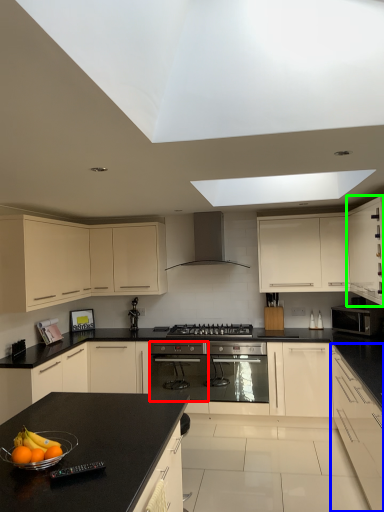
Question: Which object is positioned closest to appliance (highlighted by a red box)? Select from cabinetry (highlighted by a blue box) and cabinetry (highlighted by a green box).

Choices:
 (A) cabinetry
 (B) cabinetry

Answer: (A)